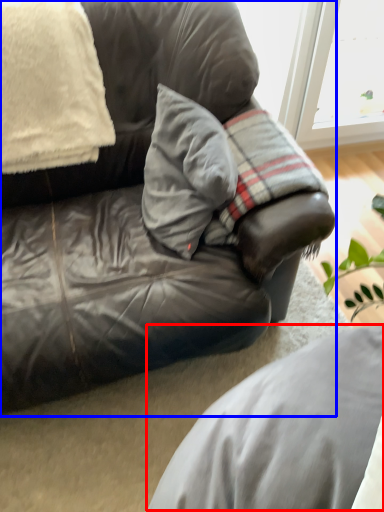
Question: Which object appears closest to the camera in this image, gray (highlighted by a red box) or studio couch (highlighted by a blue box)?

Choices:
 (A) gray
 (B) studio couch

Answer: (A)